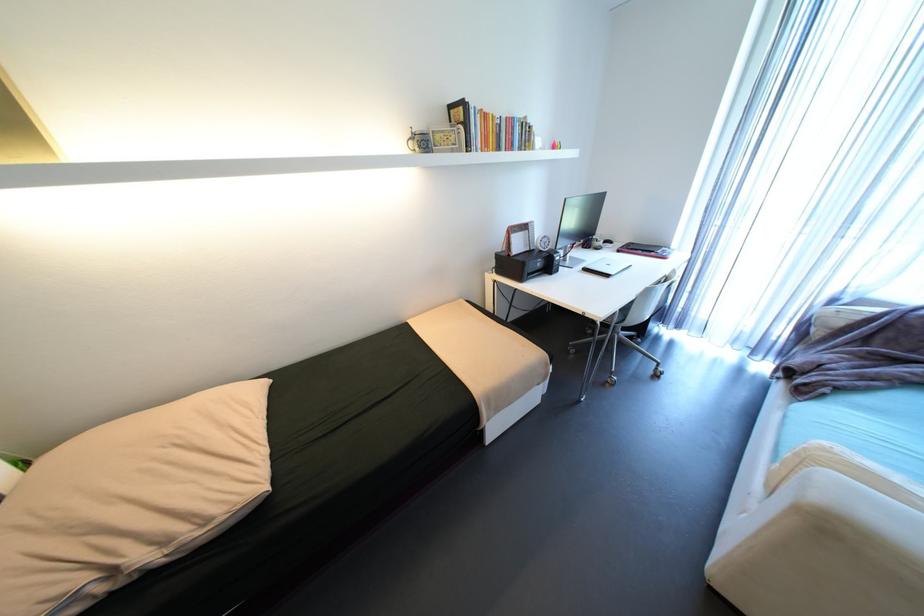
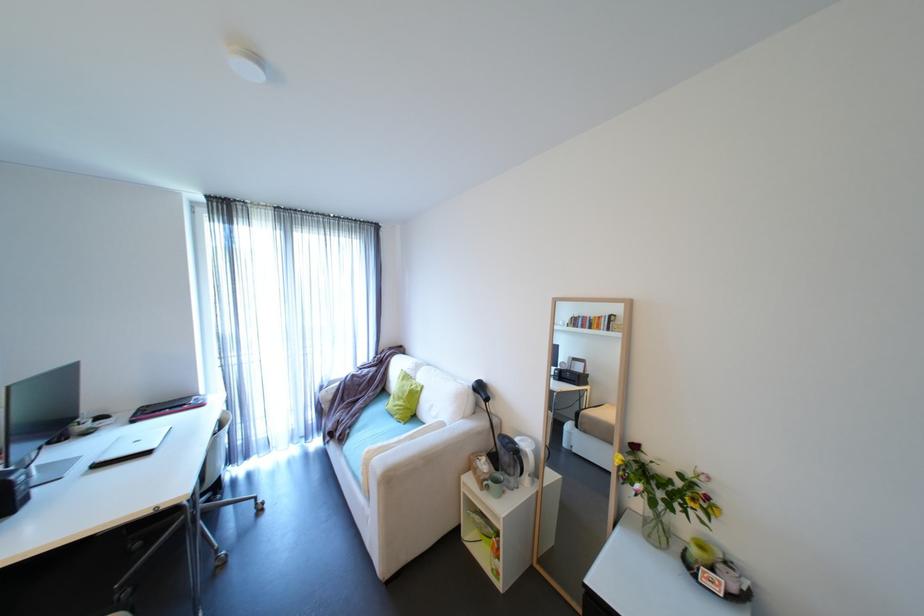
Where in the second image is the point corresponding to (852,302) from the first image?

(333, 386)